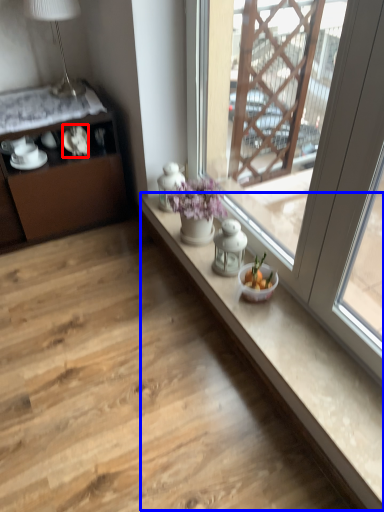
Question: Which object is closer to the camera taking this photo, tableware (highlighted by a red box) or counter top (highlighted by a blue box)?

Choices:
 (A) tableware
 (B) counter top

Answer: (B)